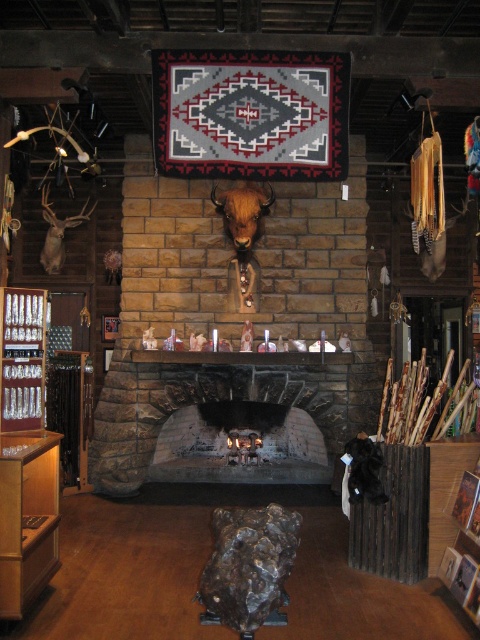
Question: Can you confirm if black stone fireplace at center is thinner than matte brown deer head at left?

Choices:
 (A) yes
 (B) no

Answer: (B)

Question: Which of the following is the closest to the observer?

Choices:
 (A) (151, 392)
 (B) (48, 220)

Answer: (A)

Question: Does black stone fireplace at center appear over matte brown deer head at left?

Choices:
 (A) no
 (B) yes

Answer: (A)

Question: Is black stone fireplace at center above matte brown deer head at left?

Choices:
 (A) no
 (B) yes

Answer: (A)

Question: Which point is closer to the camera?

Choices:
 (A) matte brown deer head at left
 (B) black stone fireplace at center

Answer: (B)